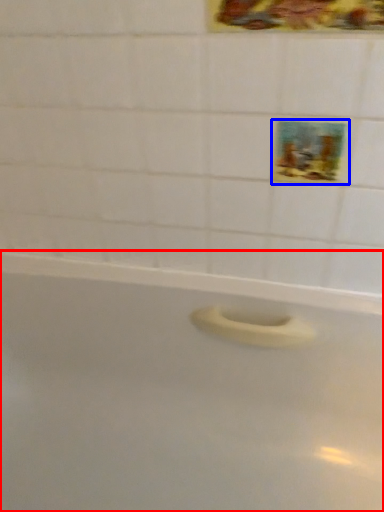
Question: Among these objects, which one is nearest to the camera, bathtub (highlighted by a red box) or decorative picture (highlighted by a blue box)?

Choices:
 (A) bathtub
 (B) decorative picture

Answer: (A)